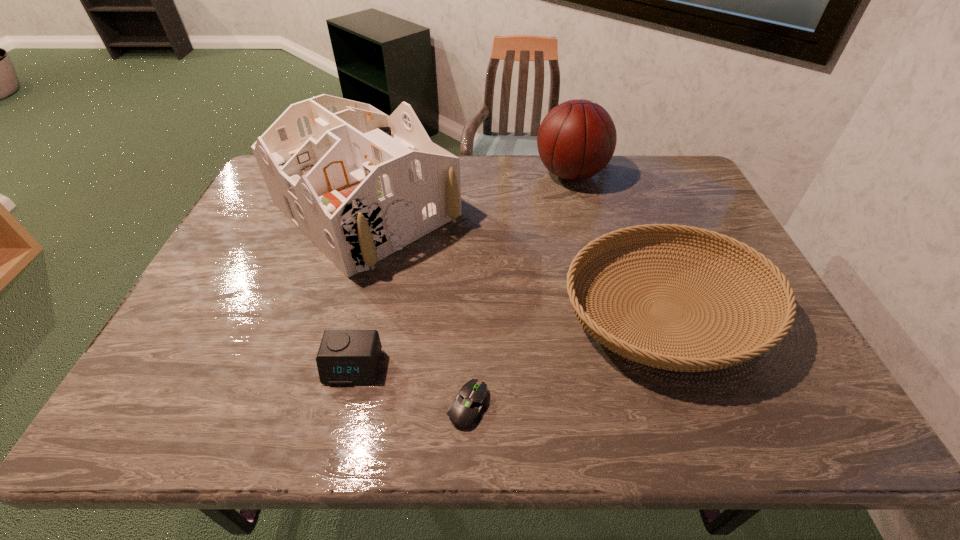
This screenshot has width=960, height=540. I want to click on dollhouse, so click(361, 185).

Where is `basketball`? This screenshot has width=960, height=540. basketball is located at coordinates (577, 138).

Find the location of a particular element. basket is located at coordinates (711, 358).

Image resolution: width=960 pixels, height=540 pixels. Identify the location of alarm clock. (345, 357).

Where is `the shortest object`? the shortest object is located at coordinates (466, 409).

I want to click on free location located on the front of the dollhouse, so click(304, 419).

Where is `free space located on the right of the basketball`? free space located on the right of the basketball is located at coordinates (627, 174).

Where is `blank space located 0.060m on the front of the basket`? The image size is (960, 540). blank space located 0.060m on the front of the basket is located at coordinates (707, 417).

Where is `free region located 0.100m on the front-facing side of the fourth tallest object`? free region located 0.100m on the front-facing side of the fourth tallest object is located at coordinates (338, 430).

You are a GUI agent. You are given a task and a screenshot of the screen. Output one action in this format:
    pyautogui.click(x=<x>, y=<y>)
    Task: Click on the free space located 0.130m on the right of the shortest object
    
    Given the screenshot: What is the action you would take?
    pyautogui.click(x=550, y=405)